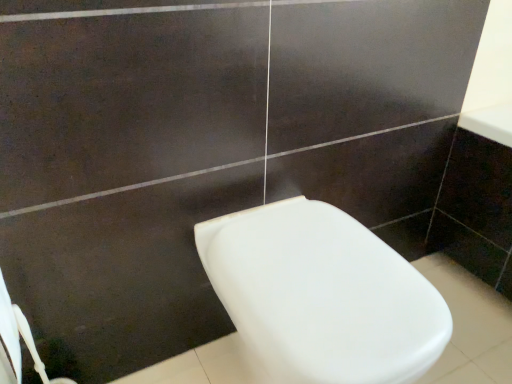
The height and width of the screenshot is (384, 512). Identify the location of white glossy toilet at center. (323, 295).

Describe the element at coordinates (323, 295) in the screenshot. I see `white glossy toilet at center` at that location.

Measure the distance between point (x=306, y=261) and camera.

A distance of 31.69 inches exists between point (x=306, y=261) and camera.

Locate an element on the screen. white glossy toilet at center is located at coordinates (323, 295).